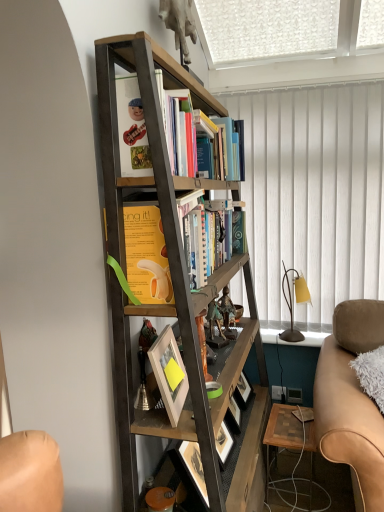
Question: Is white textured curtain at upper right taller than metallic figurine at center, which is the first toy in back-to-front order?

Choices:
 (A) no
 (B) yes

Answer: (B)

Question: Is white textured curtain at upper right to the right of metallic figurine at center, arranged as the second toy when viewed from the front, from the viewer's perspective?

Choices:
 (A) yes
 (B) no

Answer: (A)

Question: Is white textured curtain at upper right positioned before metallic figurine at center, arranged as the second toy when viewed from the front?

Choices:
 (A) no
 (B) yes

Answer: (A)

Question: Is white textured curtain at upper right facing away from metallic figurine at center, arranged as the second toy when viewed from the front?

Choices:
 (A) yes
 (B) no

Answer: (B)

Question: Are white textured curtain at upper right and metallic figurine at center, which is the first toy in back-to-front order, far apart?

Choices:
 (A) yes
 (B) no

Answer: (B)

Question: Considering the positions of white matte picture frame at center and white textured curtain at upper right in the image, is white matte picture frame at center wider or thinner than white textured curtain at upper right?

Choices:
 (A) wide
 (B) thin

Answer: (A)

Question: In terms of height, does white matte picture frame at center look taller or shorter compared to white textured curtain at upper right?

Choices:
 (A) short
 (B) tall

Answer: (A)

Question: Based on their positions, is white matte picture frame at center located to the left or right of white textured curtain at upper right?

Choices:
 (A) left
 (B) right

Answer: (A)

Question: Considering their positions, is white matte picture frame at center located in front of or behind white textured curtain at upper right?

Choices:
 (A) behind
 (B) front

Answer: (B)

Question: From the image's perspective, is white textured curtain at upper right positioned above or below white matte picture frame at center?

Choices:
 (A) below
 (B) above

Answer: (B)

Question: From their relative heights in the image, would you say white textured curtain at upper right is taller or shorter than white matte picture frame at center?

Choices:
 (A) short
 (B) tall

Answer: (B)

Question: Does point (336, 242) appear closer or farther from the camera than point (185, 398)?

Choices:
 (A) closer
 (B) farther

Answer: (B)

Question: Considering the positions of white textured curtain at upper right and white matte picture frame at center in the image, is white textured curtain at upper right wider or thinner than white matte picture frame at center?

Choices:
 (A) wide
 (B) thin

Answer: (B)

Question: In the image, is wooden/matte table at lower right on the left side or the right side of white matte picture frame at center?

Choices:
 (A) left
 (B) right

Answer: (B)

Question: Looking at their shapes, would you say wooden/matte table at lower right is wider or thinner than white matte picture frame at center?

Choices:
 (A) wide
 (B) thin

Answer: (A)